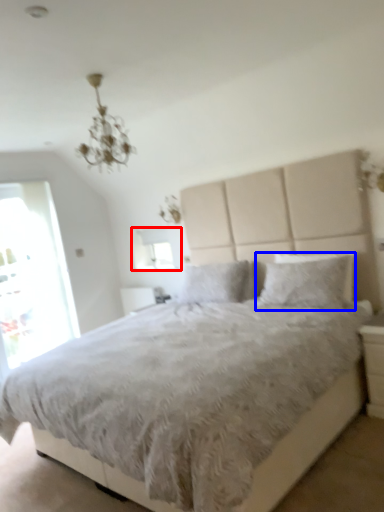
Question: Which object is further to the camera taking this photo, window screen (highlighted by a red box) or pillow (highlighted by a blue box)?

Choices:
 (A) window screen
 (B) pillow

Answer: (A)